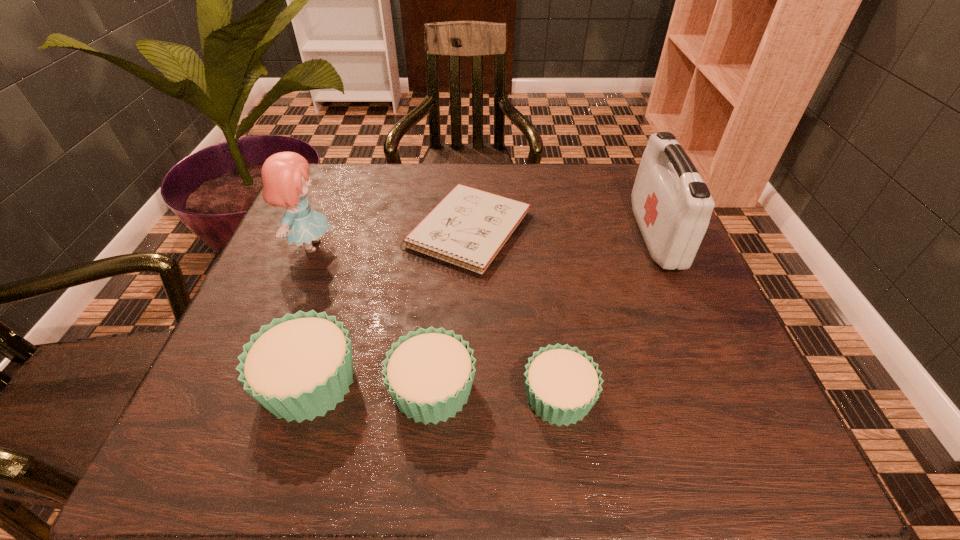
Locate an element on the screen. free space located 0.140m on the back of the rightmost cupcake is located at coordinates (546, 306).

The image size is (960, 540). I want to click on vacant space positioned 0.210m on the left of the notepad, so click(318, 231).

Image resolution: width=960 pixels, height=540 pixels. Identify the location of vacant space located 0.370m on the front side of the rightmost object. (484, 235).

I want to click on free space located on the front side of the rightmost object, so click(x=500, y=235).

At what (x,y) coordinates should I click in order to perform the action: click on blank space located 0.070m on the front side of the rightmost object. Please return your answer as a coordinate pair (x, y). The height and width of the screenshot is (540, 960). Looking at the image, I should click on (612, 235).

Identify the location of vacant area situated 0.200m on the front-facing side of the doll. This screenshot has width=960, height=540. (423, 246).

Identify the location of notepad that is at the far edge. (468, 228).

This screenshot has height=540, width=960. I want to click on the first-aid kit present at the far edge, so click(672, 205).

The width and height of the screenshot is (960, 540). Find the location of `cupcake present at the left edge`. cupcake present at the left edge is located at coordinates (299, 366).

Where is `doll present at the left edge`? doll present at the left edge is located at coordinates (285, 175).